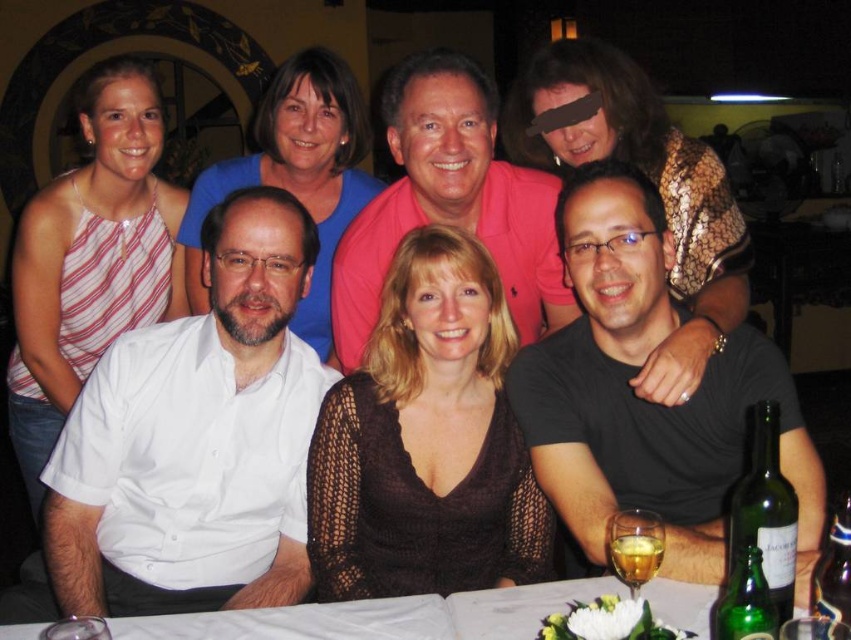
Is point (630, 284) positioned before point (530, 204)?

Yes, point (630, 284) is in front of point (530, 204).

How much distance is there between black matte shirt at center and pink matte shirt at center?

A distance of 17.54 inches exists between black matte shirt at center and pink matte shirt at center.

Which is behind, point (604, 433) or point (364, 221)?

The point (364, 221) is more distant.

Find the location of a particular element. The height and width of the screenshot is (640, 851). black matte shirt at center is located at coordinates (646, 401).

Can you confirm if green glass bottle at lower right is positioned above green glass beer at lower right?

Yes.

Between green glass bottle at lower right and green glass beer at lower right, which one is positioned lower?

green glass beer at lower right is below.

This screenshot has width=851, height=640. I want to click on green glass bottle at lower right, so click(764, 509).

Does point (437, 100) come farther from viewer compared to point (647, 563)?

Yes, it is behind point (647, 563).

Is pink matte shirt at center closer to camera compared to green glass beer at lower right?

No, it is behind green glass beer at lower right.

Where is `pink matte shirt at center`? pink matte shirt at center is located at coordinates (449, 202).